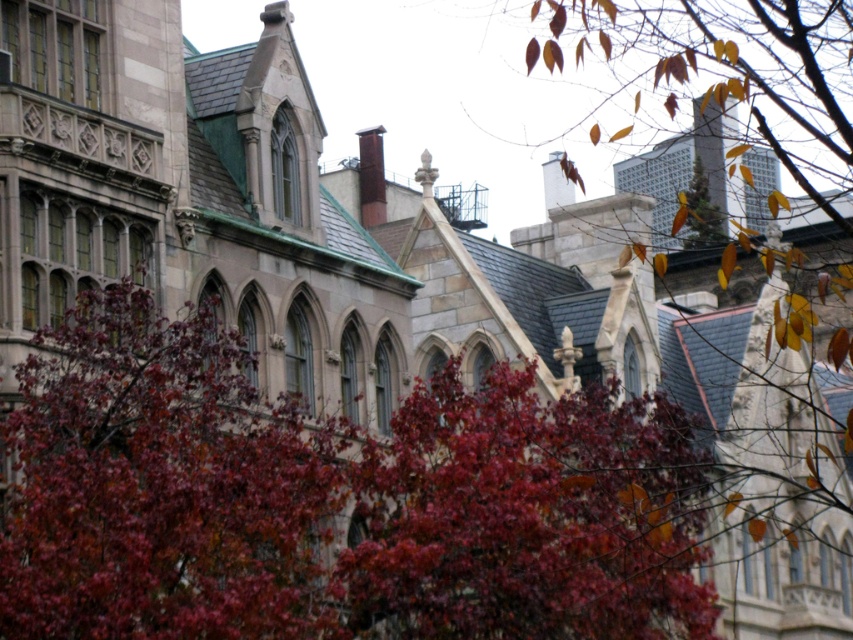
Question: Which of the following is the closest to the observer?

Choices:
 (A) (154, 346)
 (B) (685, 204)
 (C) (608, 380)

Answer: (A)

Question: Which object appears closest to the camera in this image?

Choices:
 (A) leaves matte at center
 (B) shiny red leaves at center

Answer: (A)

Question: Can you confirm if shiny red leaves at center is positioned to the left of autumn leaves at upper right?

Choices:
 (A) yes
 (B) no

Answer: (A)

Question: In this image, where is leaves matte at center located relative to autumn leaves at upper right?

Choices:
 (A) left
 (B) right

Answer: (A)

Question: Is leaves matte at center to the right of autumn leaves at upper right from the viewer's perspective?

Choices:
 (A) no
 (B) yes

Answer: (A)

Question: Considering the real-world distances, which object is closest to the leaves matte at center?

Choices:
 (A) shiny red leaves at center
 (B) autumn leaves at upper right

Answer: (A)